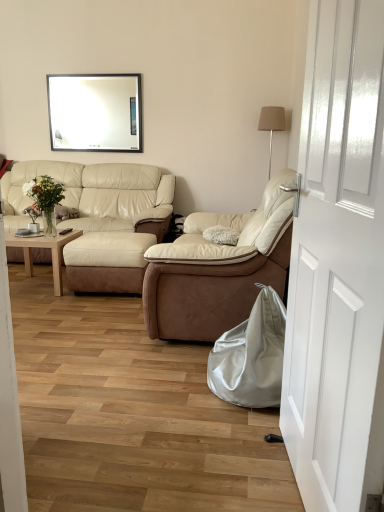
Locate an element on the screen. The image size is (384, 512). vacant area that lies in front of light wood/finished coffee table at left is located at coordinates (45, 300).